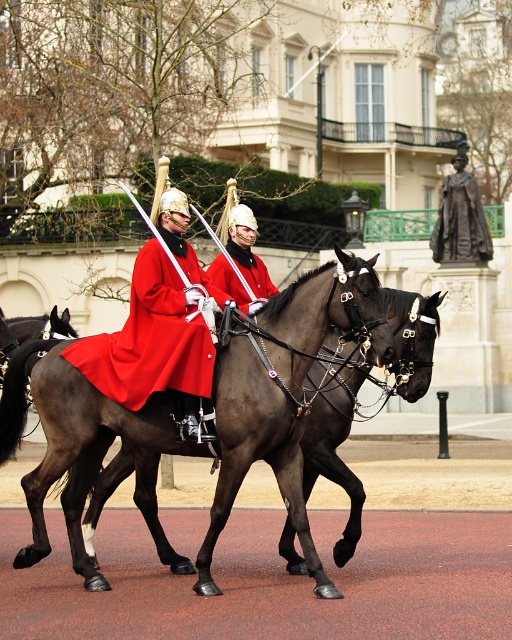
Question: Can you confirm if shiny dark brown horse at center is bigger than matte red coat at center?

Choices:
 (A) no
 (B) yes

Answer: (B)

Question: Which of the following is the farthest from the observer?

Choices:
 (A) (268, 275)
 (B) (164, 273)

Answer: (A)

Question: Does shiny dark brown horse at center appear over matte red coat at center?

Choices:
 (A) yes
 (B) no

Answer: (B)

Question: Observing the image, what is the correct spatial positioning of matte red coat at center in reference to shiny red coat at center?

Choices:
 (A) above
 (B) below

Answer: (B)

Question: Among these points, which one is farthest from the camera?

Choices:
 (A) (258, 292)
 (B) (196, 266)
 (C) (179, 570)

Answer: (A)

Question: Which object appears farthest from the camera in this image?

Choices:
 (A) matte red coat at center
 (B) shiny dark brown horse at center
 (C) shiny red coat at center

Answer: (C)